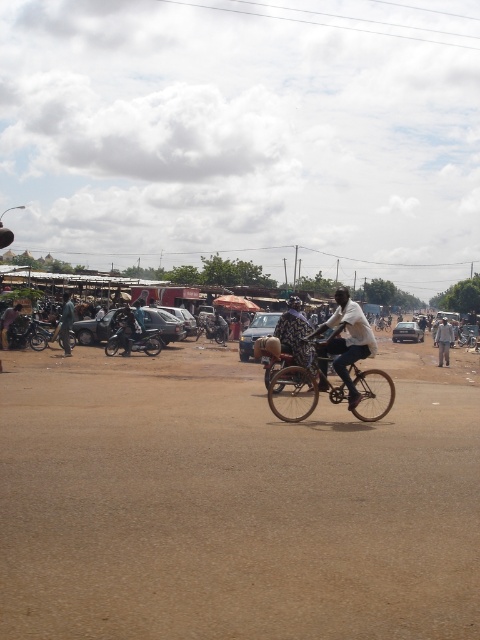
Looking at this image, you are standing at the point marked as point (133,339) in the image. What object is located exactly at that point?

The point (133,339) corresponds to the shiny black motorcycle at center left.